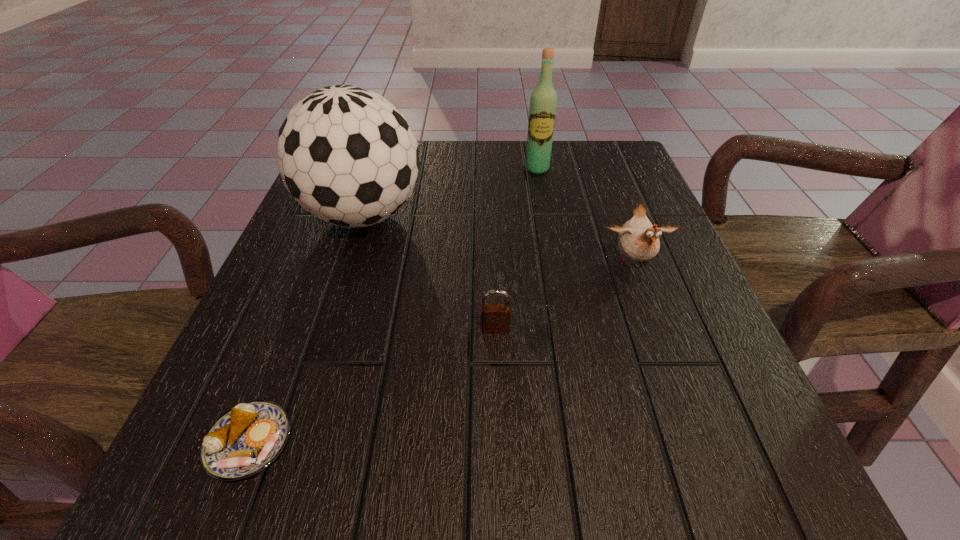
Locate an element on the screen. This screenshot has height=540, width=960. wine bottle is located at coordinates (543, 103).

This screenshot has width=960, height=540. I want to click on the farthest object, so (543, 103).

In order to click on soccer ball in this screenshot , I will do `click(347, 155)`.

Find the location of `bird`. bird is located at coordinates (638, 239).

Locate an element on the screen. the third tallest object is located at coordinates (638, 239).

This screenshot has width=960, height=540. What are the coordinates of `the second nearest object` in the screenshot? It's located at (495, 316).

This screenshot has width=960, height=540. What are the coordinates of `the third object from right to left` in the screenshot? It's located at (495, 316).

At what (x,y) coordinates should I click in order to perform the action: click on the shortest object. Please return your answer as a coordinate pair (x, y). Image resolution: width=960 pixels, height=540 pixels. Looking at the image, I should click on (245, 440).

Identify the location of the nearest object. (245, 440).

The height and width of the screenshot is (540, 960). What are the coordinates of `vacant space located 0.320m on the front-facing side of the farthest object` in the screenshot? It's located at (554, 261).